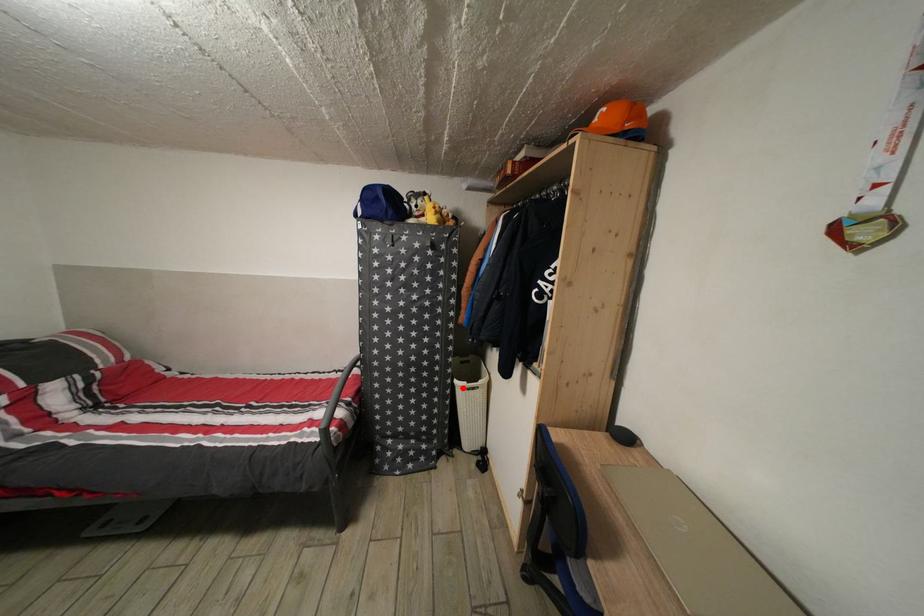
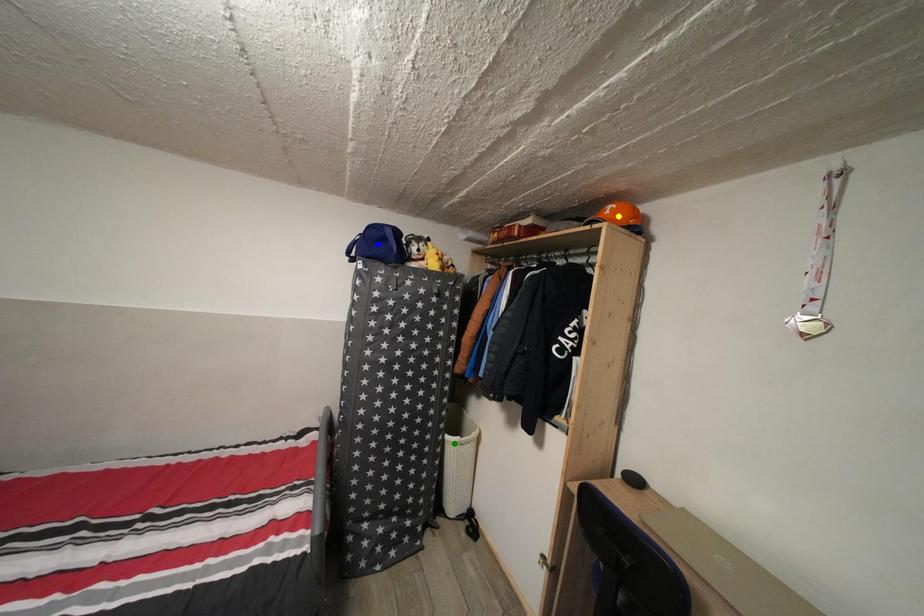
Question: I am providing you with two images of the same scene from different viewpoints. A red point is marked on the first image. You are given multiple points on the second image. Can you choose the point in image 2 that corresponds to the point in image 1?

Choices:
 (A) blue point
 (B) green point
 (C) yellow point

Answer: (B)